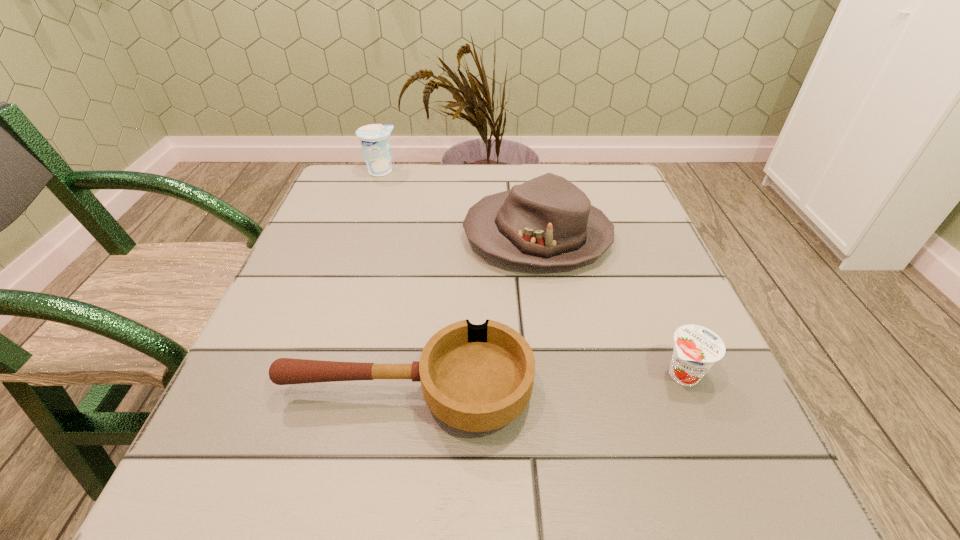
At what (x,y) coordinates should I click in order to perform the action: click on free space between the saucepan and the left yogurt. Please return your answer as a coordinate pair (x, y). Looking at the image, I should click on (394, 282).

Locate an element on the screen. The width and height of the screenshot is (960, 540). free spot between the second farthest object and the left yogurt is located at coordinates (459, 204).

You are a GUI agent. You are given a task and a screenshot of the screen. Output one action in this format:
    pyautogui.click(x=<x>, y=<y>)
    Task: Click on the vacant area that lies between the hat and the right yogurt
    
    Given the screenshot: What is the action you would take?
    pyautogui.click(x=611, y=305)

What are the coordinates of `unoccupied area between the shorter yogurt and the farther yogurt` in the screenshot? It's located at (532, 273).

The image size is (960, 540). Find the location of `free spot between the saucepan and the right yogurt`. free spot between the saucepan and the right yogurt is located at coordinates (544, 383).

Point out which object is positioned as the nearest to the third nearest object. Please provide its 2D coordinates. Your answer should be formatted as a tuple, i.e. [(x, y)], where the tuple contains the x and y coordinates of a point satisfying the conditions above.

[(477, 378)]

Identify which object is the second closest to the saucepan. Please provide its 2D coordinates. Your answer should be formatted as a tuple, i.e. [(x, y)], where the tuple contains the x and y coordinates of a point satisfying the conditions above.

[(696, 349)]

At what (x,y) coordinates should I click in order to perform the action: click on free space in the image that satisfies the following two spatial constraints: 1. with the handle on the side of the saucepan; 2. on the front side of the farthest object. Please return your answer as a coordinate pair (x, y). Looking at the image, I should click on (438, 171).

Locate an element on the screen. The height and width of the screenshot is (540, 960). vacant position in the image that satisfies the following two spatial constraints: 1. with the handle on the side of the saucepan; 2. on the back side of the shorter yogurt is located at coordinates coord(409,374).

Locate an element on the screen. The image size is (960, 540). vacant space that satisfies the following two spatial constraints: 1. on the decorative side of the hat; 2. on the back side of the shorter yogurt is located at coordinates (560, 374).